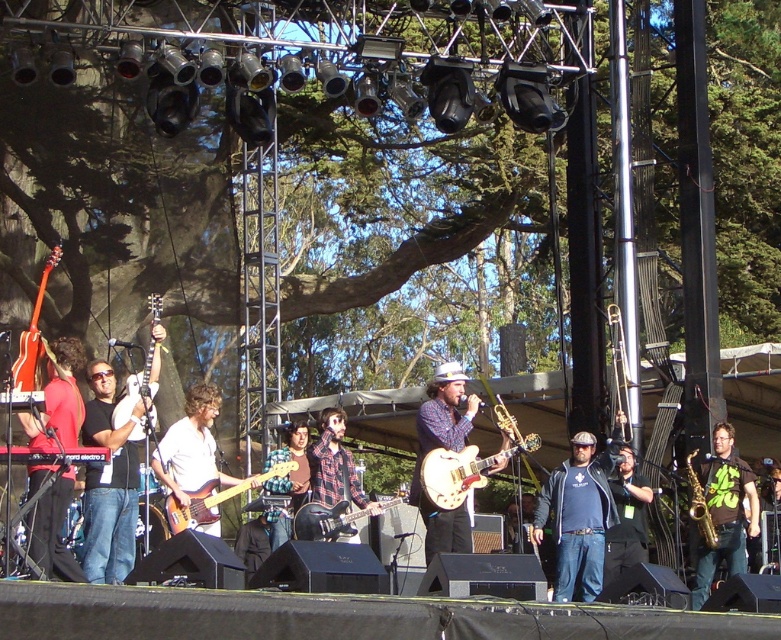
What do you see at coordinates (109, 483) in the screenshot? This screenshot has height=640, width=781. I see `black matte guitar at left` at bounding box center [109, 483].

Between black matte guitar at left and glossy wood guitar at center, which one appears on the left side from the viewer's perspective?

black matte guitar at left

Who is more forward, [127,512] or [469,472]?

Point [127,512]

You are a GUI agent. You are given a task and a screenshot of the screen. Output one action in this format:
    pyautogui.click(x=<x>, y=<y>)
    Task: Click on the black matte guitar at left
    
    Given the screenshot: What is the action you would take?
    pyautogui.click(x=109, y=483)

Does glossy wood guitar at center have a lesser width compared to matte brown electric guitar at center?

No.

Does glossy wood guitar at center appear over matte brown electric guitar at center?

Indeed, glossy wood guitar at center is positioned over matte brown electric guitar at center.

Does point (423, 476) come behind point (177, 506)?

Yes, point (423, 476) is behind point (177, 506).

Locate an element on the screen. glossy wood guitar at center is located at coordinates (462, 472).

Is plaid shirt at center in front of matte red electric guitar at left?

No, plaid shirt at center is behind matte red electric guitar at left.

Does plaid shirt at center have a lesser width compared to matte red electric guitar at left?

Correct, plaid shirt at center's width is less than matte red electric guitar at left's.

Is point (280, 522) farther from viewer compared to point (59, 259)?

Yes, it is behind point (59, 259).

Find the location of a particular element. This screenshot has width=781, height=640. plaid shirt at center is located at coordinates (291, 468).